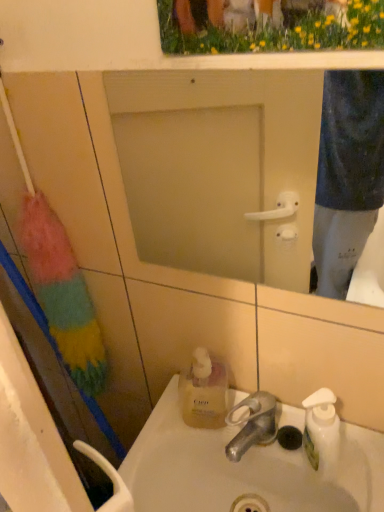
Question: Does white glossy sink at center appear on the right side of frosted glass mirror at center?

Choices:
 (A) yes
 (B) no

Answer: (A)

Question: From a real-world perspective, is white glossy sink at center positioned under frosted glass mirror at center based on gravity?

Choices:
 (A) yes
 (B) no

Answer: (A)

Question: Is white glossy sink at center next to frosted glass mirror at center?

Choices:
 (A) yes
 (B) no

Answer: (B)

Question: Is white glossy sink at center facing away from frosted glass mirror at center?

Choices:
 (A) yes
 (B) no

Answer: (B)

Question: Does white glossy sink at center have a greater width compared to frosted glass mirror at center?

Choices:
 (A) yes
 (B) no

Answer: (A)

Question: Is white glossy sink at center positioned behind frosted glass mirror at center?

Choices:
 (A) yes
 (B) no

Answer: (A)

Question: Is white glossy sink at center closer to camera compared to yellow grass at upper center?

Choices:
 (A) no
 (B) yes

Answer: (A)

Question: Is white glossy sink at center smaller than yellow grass at upper center?

Choices:
 (A) yes
 (B) no

Answer: (B)

Question: Is white glossy sink at center wider than yellow grass at upper center?

Choices:
 (A) yes
 (B) no

Answer: (A)

Question: Is white glossy sink at center placed right next to yellow grass at upper center?

Choices:
 (A) no
 (B) yes

Answer: (A)

Question: Can we say white glossy sink at center lies outside yellow grass at upper center?

Choices:
 (A) no
 (B) yes

Answer: (B)

Question: Is white glossy sink at center shorter than yellow grass at upper center?

Choices:
 (A) yes
 (B) no

Answer: (A)

Question: Considering the relative sizes of silver metallic faucet at sink center and yellow grass at upper center in the image provided, is silver metallic faucet at sink center taller than yellow grass at upper center?

Choices:
 (A) yes
 (B) no

Answer: (B)